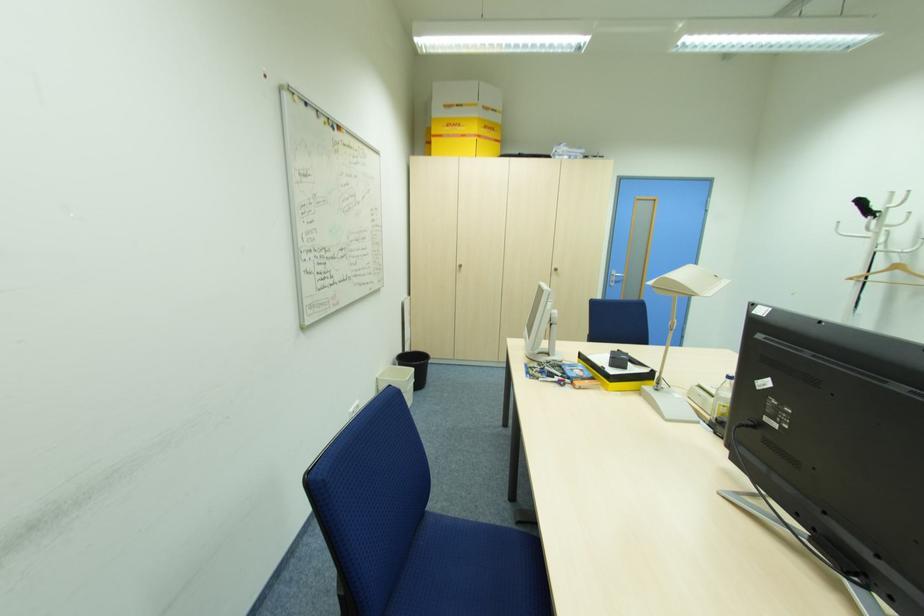
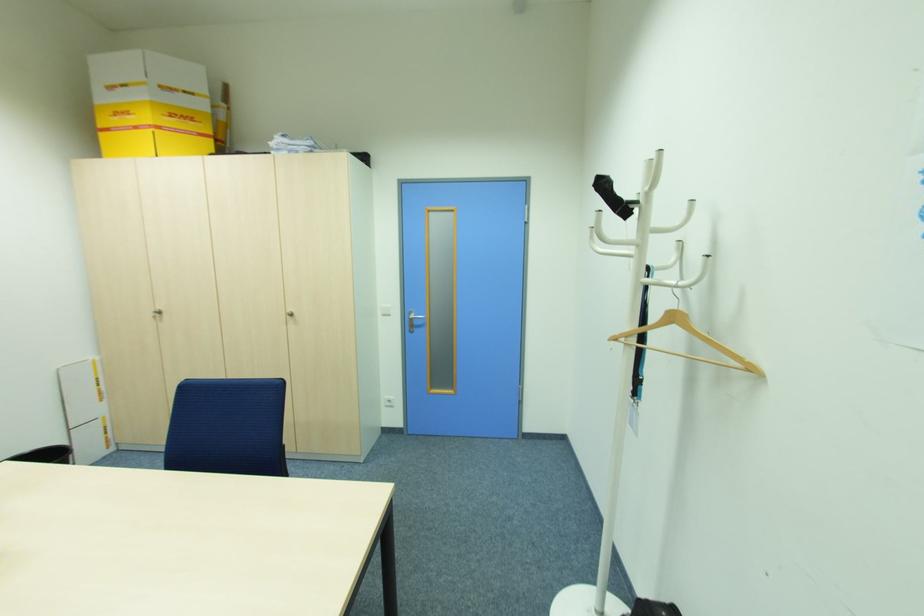
The images are taken continuously from a first-person perspective. In which direction are you moving?

The movement direction of the cameraman is right, forward.